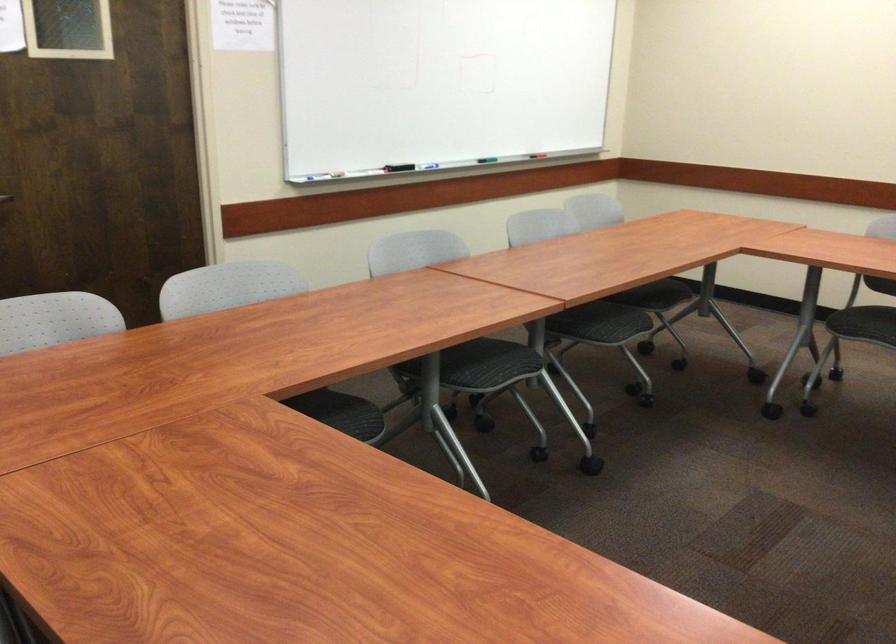
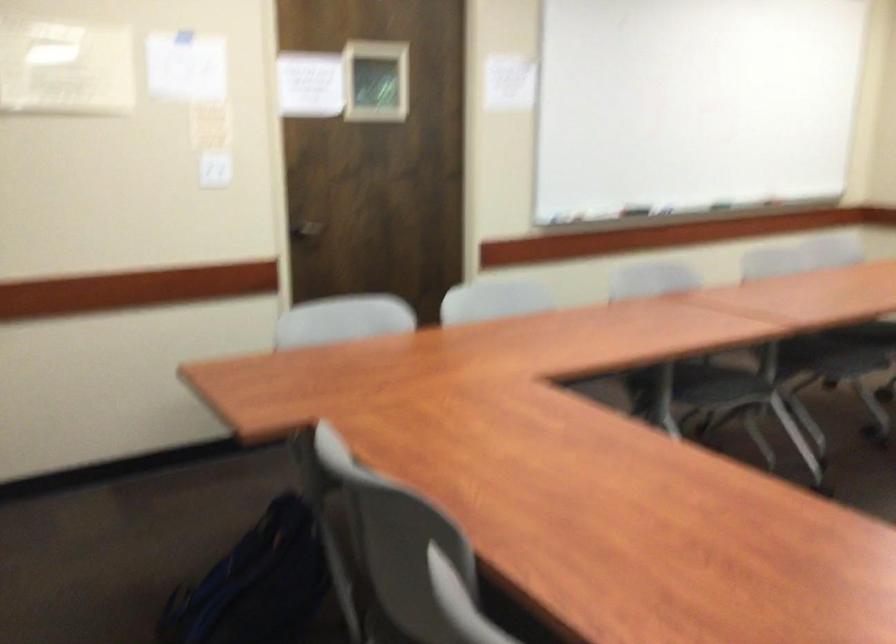
Question: What movement of the cameraman would produce the second image?

Choices:
 (A) Left
 (B) Right
 (C) Forward
 (D) Backward

Answer: (D)